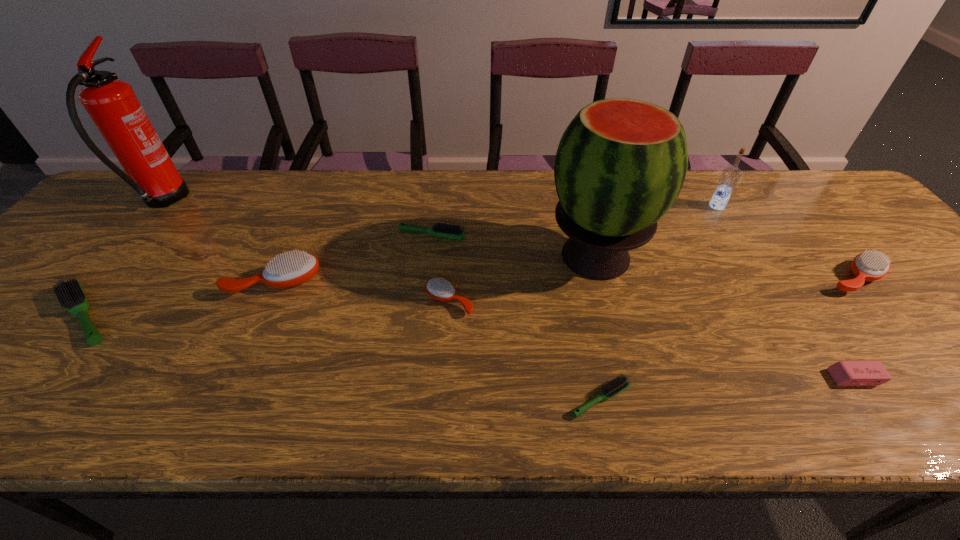
I want to click on fire extinguisher, so click(x=112, y=104).

Find the location of a particular element. green watermelon is located at coordinates (620, 165).

What are the coordinates of `blue vodka` in the screenshot? It's located at (730, 176).

In order to click on vodka in this screenshot , I will do `click(730, 176)`.

I want to click on the tallest hairbrush, so click(x=290, y=270).

In order to click on the seventh shortest object in this screenshot , I will do `click(290, 270)`.

Find the location of a particular element. The image size is (960, 540). the second biggest orange hairbrush is located at coordinates (867, 266).

You are a GUI agent. You are given a task and a screenshot of the screen. Output one action in this format:
    pyautogui.click(x=<x>, y=<y>)
    Task: Click on the rightmost orange hairbrush
    Image resolution: width=960 pixels, height=540 pixels.
    Given the screenshot: What is the action you would take?
    pyautogui.click(x=867, y=266)

Where is `the leftmost hairbrush`? the leftmost hairbrush is located at coordinates (70, 294).

The width and height of the screenshot is (960, 540). Identify the location of the second farthest light hairbrush. (70, 294).